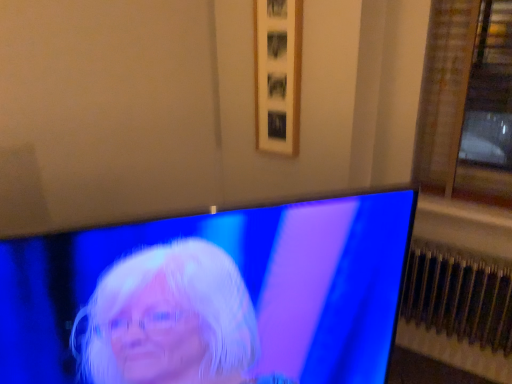
Question: Which is correct: wooden picture frame at upper center is inside shiny blue screen at center, or outside of it?

Choices:
 (A) outside
 (B) inside

Answer: (A)

Question: Considering the positions of wooden picture frame at upper center and shiny blue screen at center in the image, is wooden picture frame at upper center taller or shorter than shiny blue screen at center?

Choices:
 (A) tall
 (B) short

Answer: (A)

Question: Estimate the real-world distances between objects in this image. Which object is farther from the wooden picture frame at upper center?

Choices:
 (A) metallic silver radiator at lower right
 (B) shiny blue screen at center

Answer: (B)

Question: Estimate the real-world distances between objects in this image. Which object is farther from the shiny blue screen at center?

Choices:
 (A) wooden picture frame at upper center
 (B) metallic silver radiator at lower right

Answer: (B)